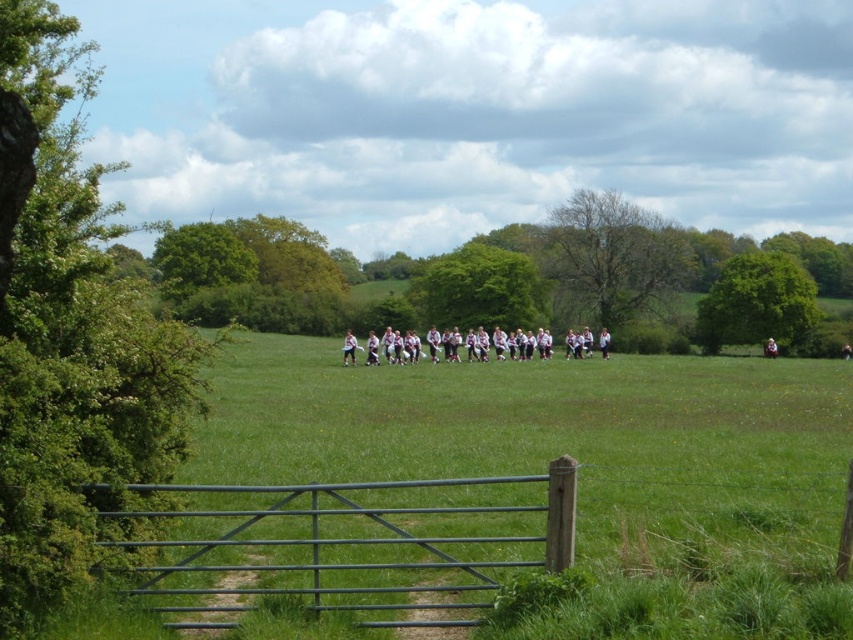
Does white fabric shirt at center appear under white cotton shirt at center?

No, white fabric shirt at center is not below white cotton shirt at center.

Can you confirm if white fabric shirt at center is bigger than white cotton shirt at center?

Incorrect, white fabric shirt at center is not larger than white cotton shirt at center.

Is point (351, 333) less distant than point (769, 340)?

Yes.

The width and height of the screenshot is (853, 640). I want to click on white fabric shirt at center, so click(347, 348).

Does white fabric people at center appear over white cotton shirt at center?

Indeed, white fabric people at center is positioned over white cotton shirt at center.

Between point (456, 344) and point (767, 356), which one is positioned behind?

The point (767, 356) is behind.

Locate an element on the screen. The width and height of the screenshot is (853, 640). white fabric people at center is located at coordinates (399, 348).

Between point (379, 589) and point (769, 349), which one is positioned in front?

Point (379, 589) is more forward.

At what (x,y) coordinates should I click in order to perform the action: click on green painted metal gate at lower center. Please return your answer as a coordinate pair (x, y). This screenshot has height=640, width=853. Looking at the image, I should click on (357, 545).